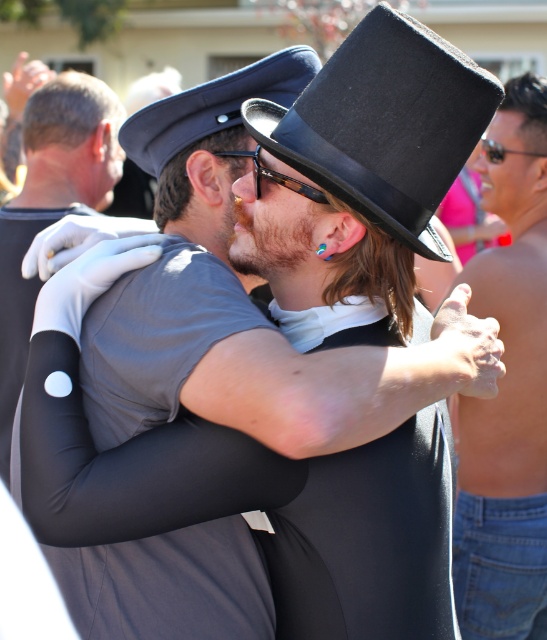
Does shiny skin torso at right appear over blue fabric cap at upper center?

Actually, shiny skin torso at right is below blue fabric cap at upper center.

Does point (485, 545) come closer to viewer compared to point (228, 112)?

No, it is behind (228, 112).

Locate an element on the screen. shiny skin torso at right is located at coordinates (508, 388).

I want to click on shiny skin torso at right, so click(x=508, y=388).

From the picture: Which is above, shiny skin torso at right or black leather dress hat at upper center?

black leather dress hat at upper center

Which is behind, point (470, 451) or point (375, 128)?

The point (470, 451) is behind.

Identify the location of shiny skin torso at right. The width and height of the screenshot is (547, 640). (508, 388).

Locate an element on the screen. The image size is (547, 640). white matte glove at upper left is located at coordinates (50, 205).

In the scene shown: Can you confirm if white matte glove at upper left is bigger than blue fabric cap at upper center?

Correct, white matte glove at upper left is larger in size than blue fabric cap at upper center.

Find the location of a particular element. white matte glove at upper left is located at coordinates (50, 205).